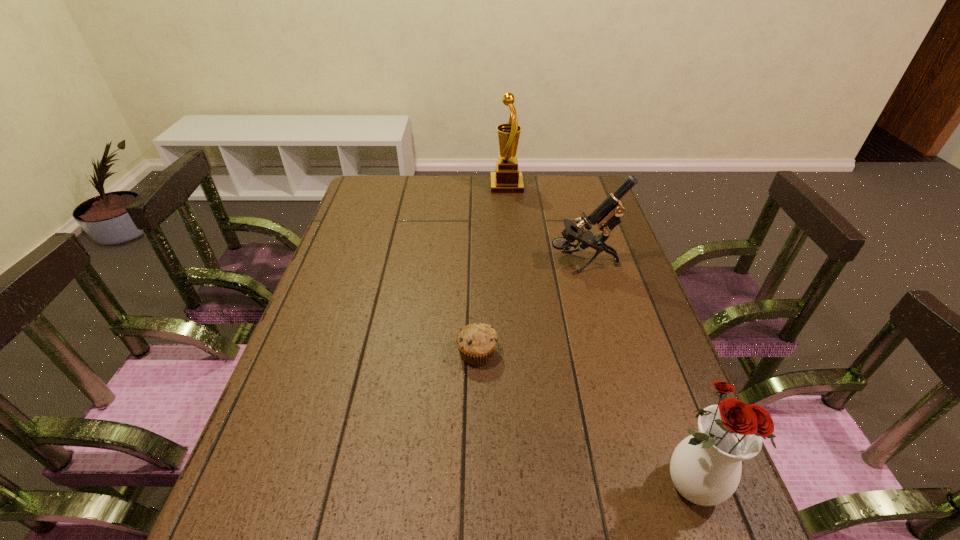
Where is `free space in the image that satisfies the following two spatial constraints: 1. through the eyepiece of the microscope; 2. on the left side of the vase`? This screenshot has width=960, height=540. free space in the image that satisfies the following two spatial constraints: 1. through the eyepiece of the microscope; 2. on the left side of the vase is located at coordinates (645, 485).

You are a GUI agent. You are given a task and a screenshot of the screen. Output one action in this format:
    pyautogui.click(x=<x>, y=<y>)
    Task: Click on the vacant area that satisfies the following two spatial constraints: 1. on the front-facing side of the tallest object; 2. on the left side of the nearest object
    
    Given the screenshot: What is the action you would take?
    pyautogui.click(x=534, y=485)